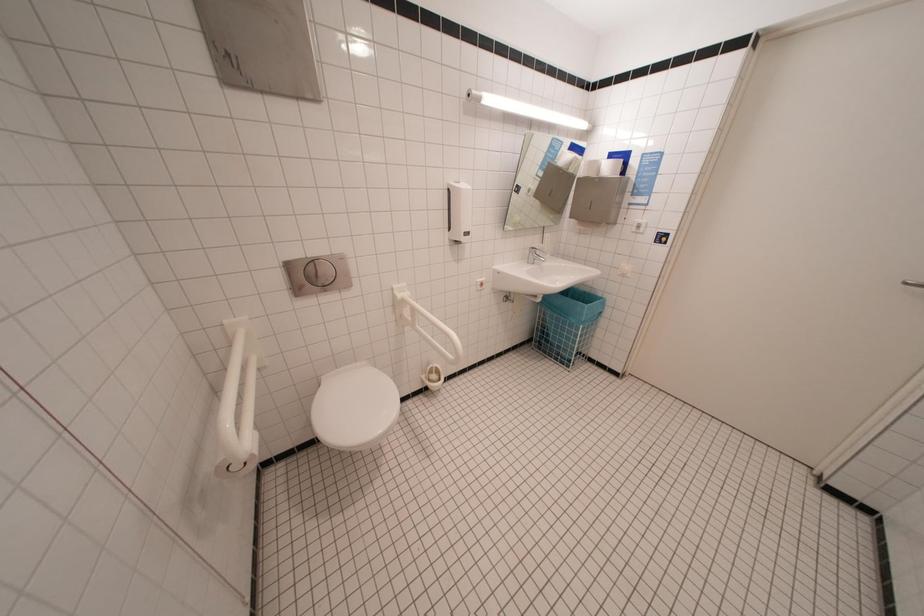
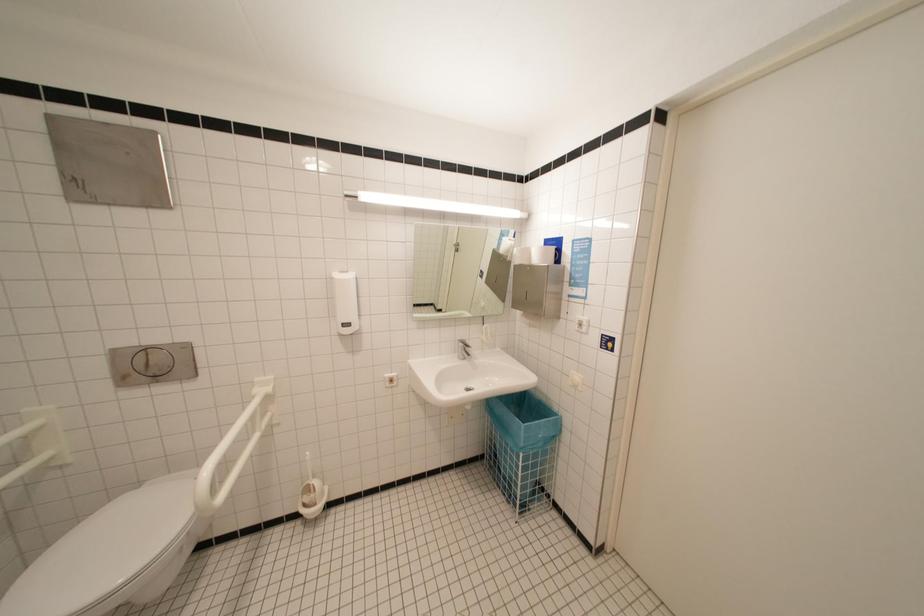
Which direction would the cameraman need to move to produce the second image?

The cameraman moved toward right, forward.